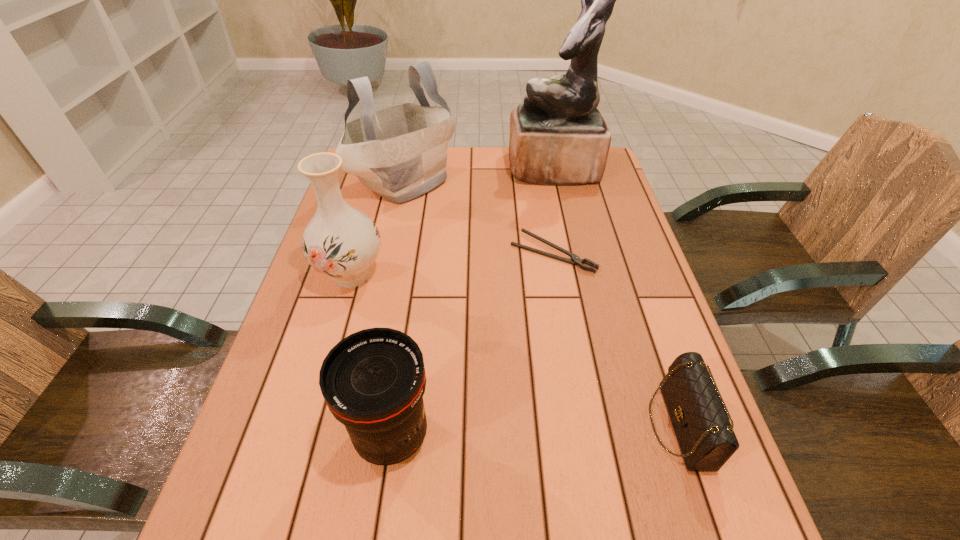
I want to click on free space in the image that satisfies the following two spatial constraints: 1. on the front side of the shopping bag; 2. on the right side of the shortest object, so click(390, 253).

Where is `free space that satisfies the following two spatial constraints: 1. in a relaxed pose on the tallest object; 2. on the front side of the shortest object`? The height and width of the screenshot is (540, 960). free space that satisfies the following two spatial constraints: 1. in a relaxed pose on the tallest object; 2. on the front side of the shortest object is located at coordinates pyautogui.click(x=571, y=253).